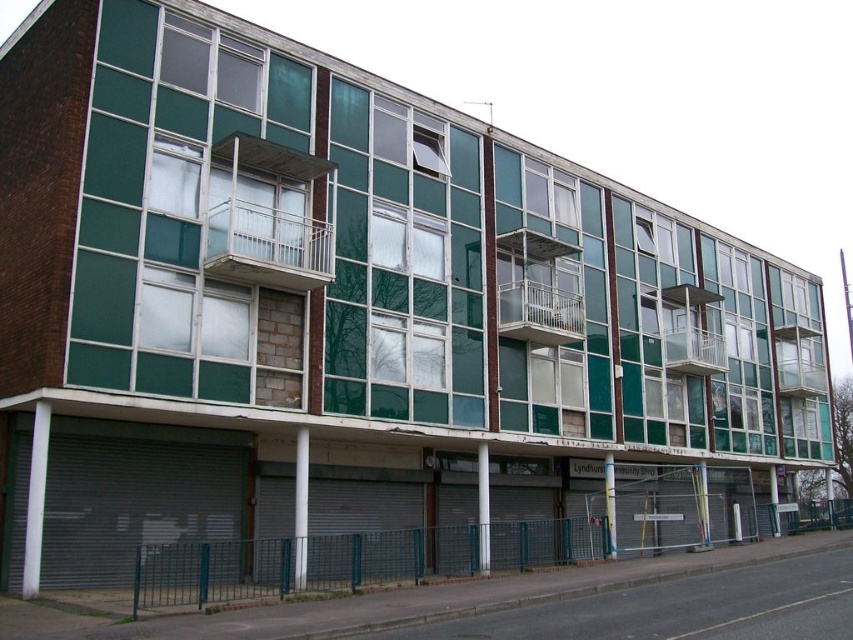
Question: Among these points, which one is nearest to the camera?

Choices:
 (A) (549, 275)
 (B) (257, 260)
 (C) (813, 342)
 (D) (701, 289)

Answer: (B)

Question: Is white metal balcony at upper center smaller than clear glass balcony at upper right?

Choices:
 (A) no
 (B) yes

Answer: (B)

Question: Which object is the closest to the metallic silver balcony at upper right?

Choices:
 (A) white metal balcony at center
 (B) clear glass balcony at upper right
 (C) white metal balcony at upper center

Answer: (A)

Question: Can you confirm if white metal balcony at center is positioned below metallic silver balcony at upper right?

Choices:
 (A) yes
 (B) no

Answer: (B)

Question: Which point appears farthest from the camera in this image?

Choices:
 (A) (695, 310)
 (B) (815, 365)
 (C) (549, 276)

Answer: (B)

Question: Can you confirm if white metal balcony at center is positioned above clear glass balcony at upper right?

Choices:
 (A) yes
 (B) no

Answer: (A)